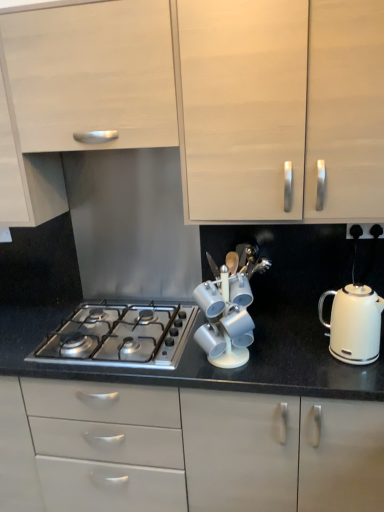
Question: Does stainless steel gas stove at center have a greater width compared to matte white cabinet at upper left, which appears as the 2th cabinetry when viewed from the top?

Choices:
 (A) no
 (B) yes

Answer: (B)

Question: Can you confirm if stainless steel gas stove at center is positioned to the right of matte white cabinet at upper left, which appears as the 2th cabinetry when viewed from the top?

Choices:
 (A) yes
 (B) no

Answer: (A)

Question: Considering the relative sizes of stainless steel gas stove at center and matte white cabinet at upper left, which appears as the 2th cabinetry when viewed from the top, in the image provided, is stainless steel gas stove at center thinner than matte white cabinet at upper left, which appears as the 2th cabinetry when viewed from the top,?

Choices:
 (A) no
 (B) yes

Answer: (A)

Question: Is stainless steel gas stove at center outside of matte white cabinet at upper left, which appears as the 2th cabinetry when viewed from the top?

Choices:
 (A) no
 (B) yes

Answer: (B)

Question: Is matte white cabinet at upper left, arranged as the third cabinetry when ordered from the bottom, inside stainless steel gas stove at center?

Choices:
 (A) no
 (B) yes

Answer: (A)

Question: In terms of size, does stainless steel gas stove at center appear bigger or smaller than matte white cabinet at upper left, which appears as the 2th cabinetry when viewed from the top?

Choices:
 (A) big
 (B) small

Answer: (B)

Question: Do you think stainless steel gas stove at center is within matte white cabinet at upper left, which appears as the 2th cabinetry when viewed from the top, or outside of it?

Choices:
 (A) outside
 (B) inside

Answer: (A)

Question: Considering the relative positions of stainless steel gas stove at center and matte white cabinet at upper left, which appears as the 2th cabinetry when viewed from the top, in the image provided, is stainless steel gas stove at center to the left or to the right of matte white cabinet at upper left, which appears as the 2th cabinetry when viewed from the top,?

Choices:
 (A) right
 (B) left

Answer: (A)

Question: In terms of width, does stainless steel gas stove at center look wider or thinner when compared to matte white cabinet at upper left, arranged as the third cabinetry when ordered from the bottom?

Choices:
 (A) thin
 (B) wide

Answer: (B)

Question: In terms of height, does white matte cabinet at upper center, which is counted as the third cabinetry, starting from the top, look taller or shorter compared to white glossy kettle at right?

Choices:
 (A) short
 (B) tall

Answer: (B)

Question: Is point (253, 31) positioned closer to the camera than point (342, 305)?

Choices:
 (A) farther
 (B) closer

Answer: (B)

Question: From the image's perspective, is white matte cabinet at upper center, which is counted as the third cabinetry, starting from the top, positioned above or below white glossy kettle at right?

Choices:
 (A) above
 (B) below

Answer: (A)

Question: Is white matte cabinet at upper center, which is counted as the third cabinetry, starting from the top, inside or outside of white glossy kettle at right?

Choices:
 (A) outside
 (B) inside

Answer: (A)

Question: From the image's perspective, relative to white matte cabinet at upper center, the 2th cabinetry when ordered from bottom to top, is stainless steel gas stove at center above or below?

Choices:
 (A) below
 (B) above

Answer: (A)

Question: From a real-world perspective, relative to white matte cabinet at upper center, the 2th cabinetry when ordered from bottom to top, is stainless steel gas stove at center vertically above or below?

Choices:
 (A) below
 (B) above

Answer: (A)